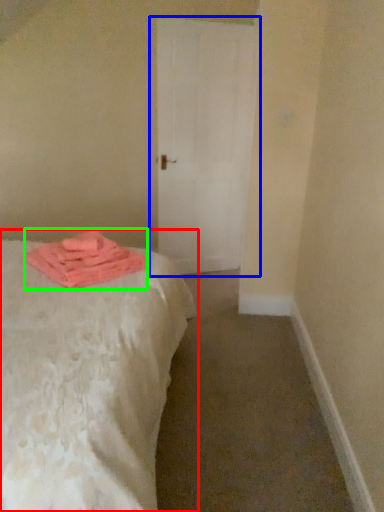
Question: Which is farther away from bed (highlighted by a red box)? door (highlighted by a blue box) or material (highlighted by a green box)?

Choices:
 (A) door
 (B) material

Answer: (A)